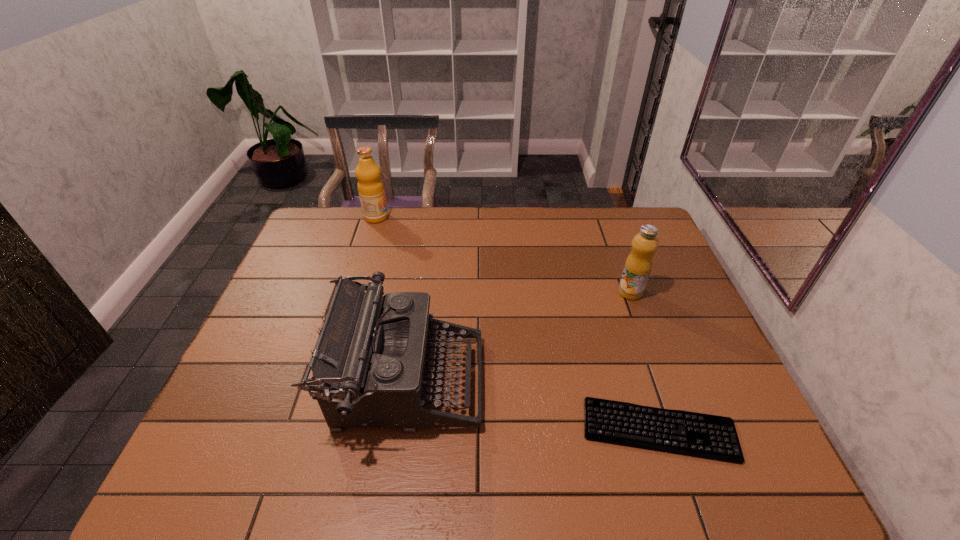
Locate an element on the screen. The image size is (960, 540). free space at the far left corner is located at coordinates (328, 238).

Locate an element on the screen. Image resolution: width=960 pixels, height=540 pixels. vacant space in between the typewriter and the shorter fruit juice is located at coordinates pyautogui.click(x=518, y=337).

Locate an element on the screen. The width and height of the screenshot is (960, 540). vacant region between the right fruit juice and the shortest object is located at coordinates (645, 361).

At what (x,y) coordinates should I click in order to perform the action: click on vacant area that lies between the computer keyboard and the second farthest object. Please return your answer as a coordinate pair (x, y). The width and height of the screenshot is (960, 540). Looking at the image, I should click on pos(645,361).

Identify the location of vacant point located between the farthest object and the right fruit juice. (503, 254).

Identify the location of vacant area between the computer keyboard and the shorter fruit juice. This screenshot has height=540, width=960. (645, 361).

Find the location of `free point between the right fruit juice and the typewriter`. free point between the right fruit juice and the typewriter is located at coordinates click(x=518, y=337).

Find the location of a particular element. vacant point located between the shortest object and the typewriter is located at coordinates (533, 406).

Where is `free spot between the typewriter and the second farthest object`? This screenshot has height=540, width=960. free spot between the typewriter and the second farthest object is located at coordinates (518, 337).

Select which object is the third closest to the right fruit juice. Please provide its 2D coordinates. Your answer should be formatted as a tuple, i.e. [(x, y)], where the tuple contains the x and y coordinates of a point satisfying the conditions above.

[(371, 191)]